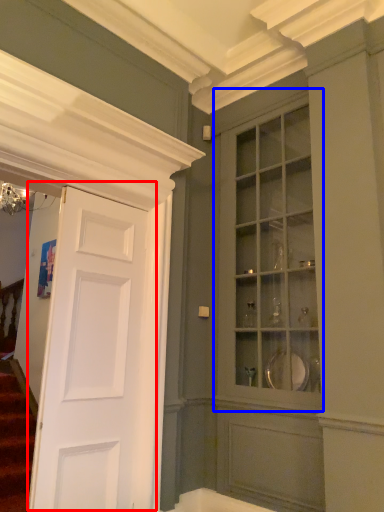
Question: Among these objects, which one is nearest to the camera, door (highlighted by a red box) or cabinetry (highlighted by a blue box)?

Choices:
 (A) door
 (B) cabinetry

Answer: (A)